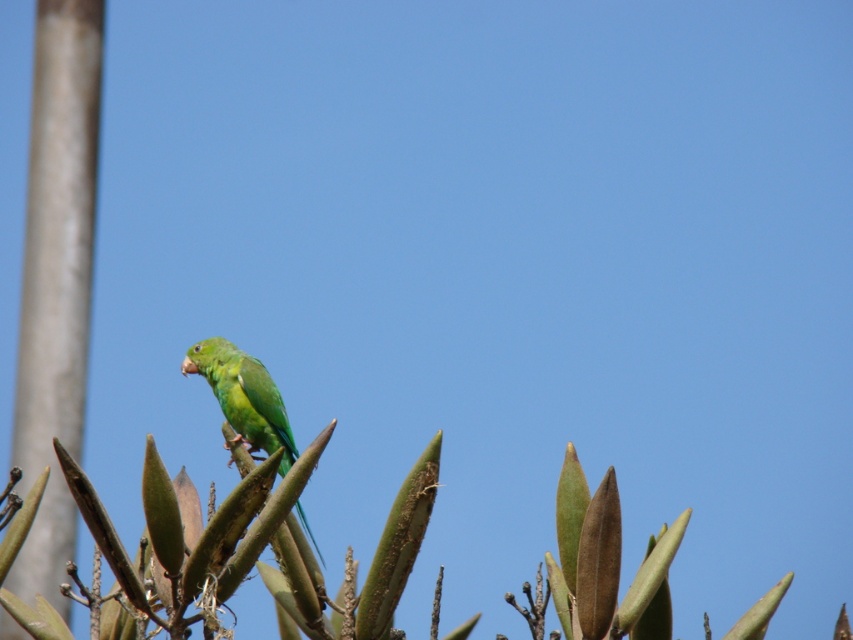
You are standing in a park and see a smooth gray pole at left. There is a point at coordinate point (56,278). Is this point located on the smooth gray pole at left?

Yes, the point (56,278) is located on the smooth gray pole at left.